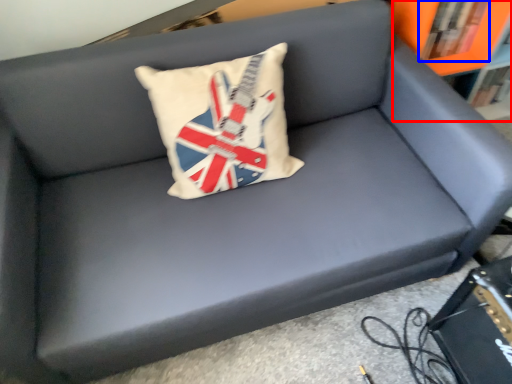
Question: Which object is further to the camera taking this photo, bookcase (highlighted by a red box) or book (highlighted by a blue box)?

Choices:
 (A) bookcase
 (B) book

Answer: (B)